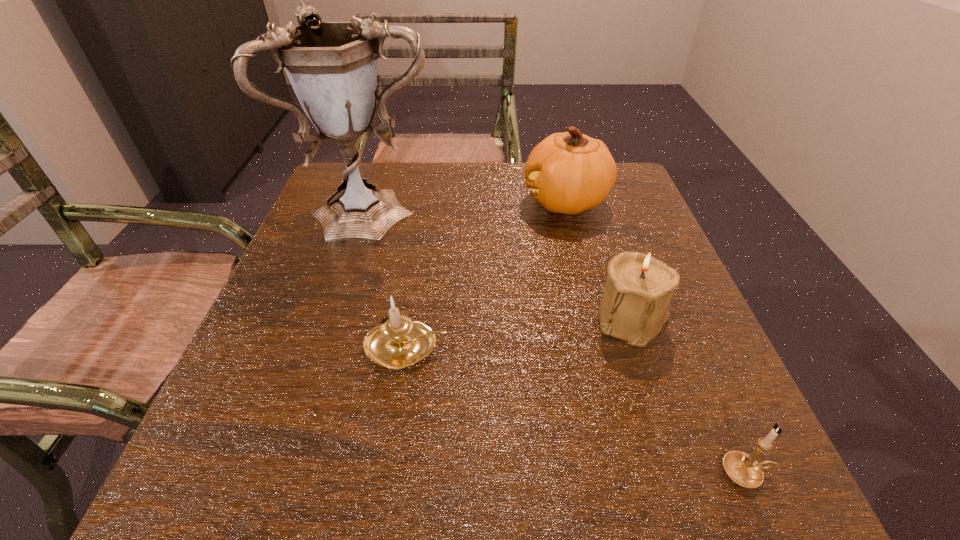
Locate an element on the screen. Image resolution: width=960 pixels, height=540 pixels. vacant area at the near edge of the desktop is located at coordinates (617, 442).

The width and height of the screenshot is (960, 540). I want to click on vacant space at the left edge of the desktop, so click(366, 257).

Where is `free spot at the right edge of the desktop`? free spot at the right edge of the desktop is located at coordinates (633, 217).

In the image, there is a desktop. Find the location of `vacant space at the far left corner`. vacant space at the far left corner is located at coordinates (327, 194).

In the image, there is a desktop. At what (x,y) coordinates should I click in order to perform the action: click on vacant space at the near left corner. Please return your answer as a coordinate pair (x, y). This screenshot has height=540, width=960. Looking at the image, I should click on (218, 490).

This screenshot has width=960, height=540. What are the coordinates of `free space that is in between the tallest candle holder and the trophy cup` in the screenshot? It's located at (504, 266).

I want to click on free spot between the third shortest object and the trophy cup, so click(504, 266).

Identify the location of free space that is in between the tallest candle holder and the leftmost candle holder. (519, 333).

This screenshot has height=540, width=960. What are the coordinates of `free space between the pumpkin and the third tallest object` in the screenshot? It's located at (599, 261).

Where is `empty location between the nearest object and the tallest object`? The height and width of the screenshot is (540, 960). empty location between the nearest object and the tallest object is located at coordinates (561, 342).